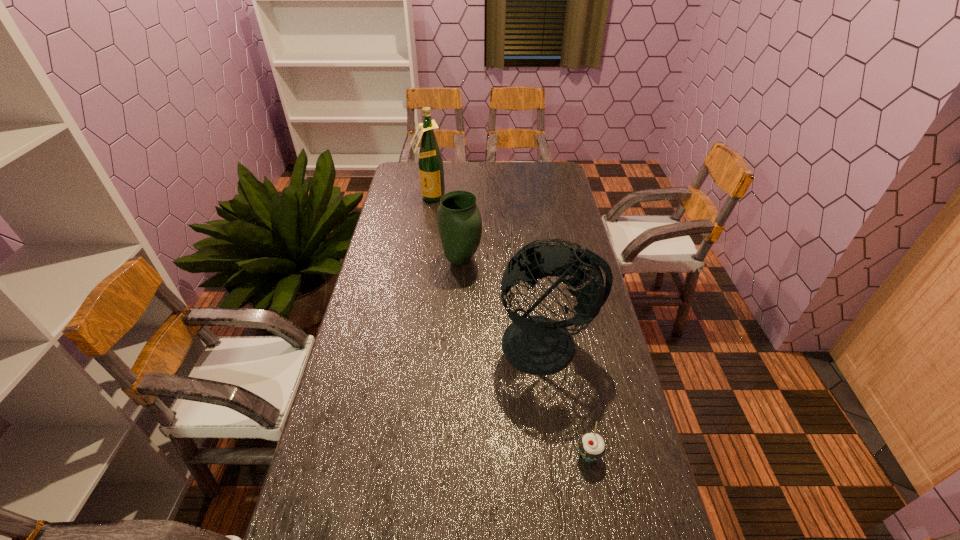
Find the location of a particular element. This screenshot has height=540, width=960. object that is the closest one to the globe is located at coordinates (592, 447).

The width and height of the screenshot is (960, 540). In order to click on free space that satisfies the following two spatial constraints: 1. on the front-facing side of the shortest object; 2. on the right side of the leftmost object in this screenshot , I will do `click(390, 455)`.